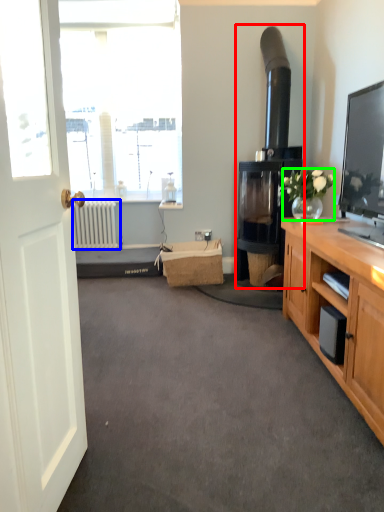
Question: Considering the real-world distances, which object is closest to fireplace (highlighted by a red box)? radiator (highlighted by a blue box) or houseplant (highlighted by a green box).

Choices:
 (A) radiator
 (B) houseplant

Answer: (B)